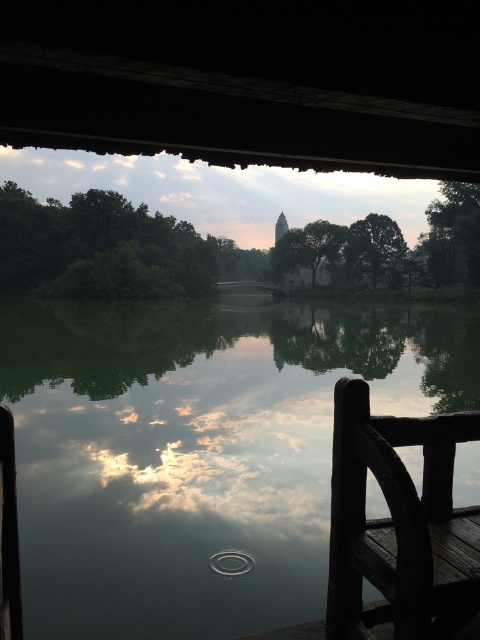
You are standing on the wooden structure and want to take a photo of the green reflective water at center and the dark wood rail at lower right. Which object will occupy more space in your photo?

The green reflective water at center will occupy more space in the photo because it has a larger size compared to the dark wood rail at lower right.

In the scene shown: You are standing on the wooden structure and want to place a 10 meter long wooden plank from the dark wood rail at lower right to reach the green reflective water at center. Is this possible?

The distance between the dark wood rail at lower right and the green reflective water at center is 9.89 meters. Since the wooden plank is 10 meters long, it can span the distance and reach the green reflective water at center.